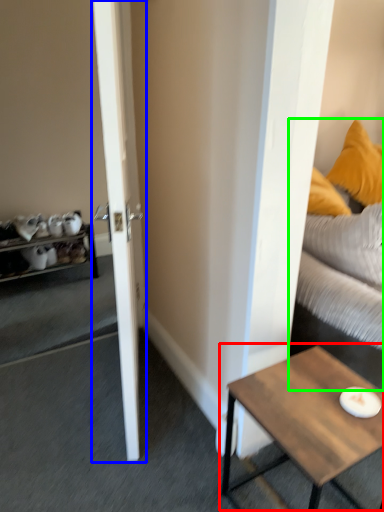
Question: Based on their relative distances, which object is farther from coffee table (highlighted by a red box)? Choose from door (highlighted by a blue box) and studio couch (highlighted by a green box).

Choices:
 (A) door
 (B) studio couch

Answer: (A)